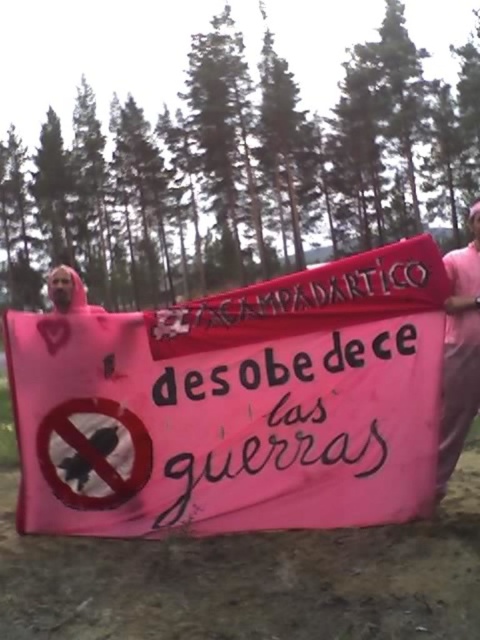
Question: Is pink fabric banner at center smaller than pink fabric at center?

Choices:
 (A) no
 (B) yes

Answer: (A)

Question: Which object appears farthest from the camera in this image?

Choices:
 (A) pink fabric at center
 (B) pink fabric banner at center

Answer: (A)

Question: Where is pink fabric banner at center located in relation to pink fabric at center in the image?

Choices:
 (A) left
 (B) right

Answer: (A)

Question: Can you confirm if pink fabric banner at center is positioned to the right of pink fabric at center?

Choices:
 (A) no
 (B) yes

Answer: (A)